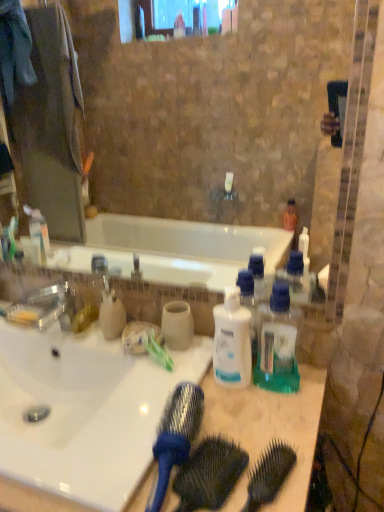
Identify the location of vacant area located to the right-hand side of white plastic bottle at center, the 2th bottle from the right. (290, 388).